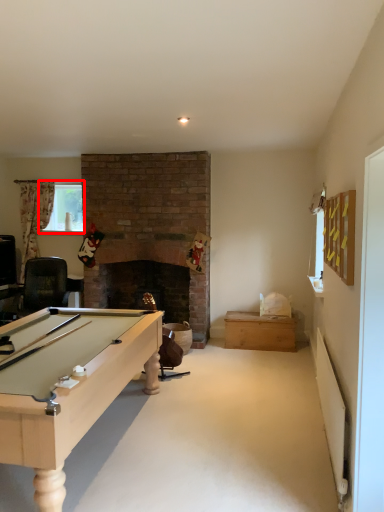
Question: From the image's perspective, what is the correct spatial relationship of window screen (annotated by the red box) in relation to drawer?

Choices:
 (A) below
 (B) above

Answer: (B)